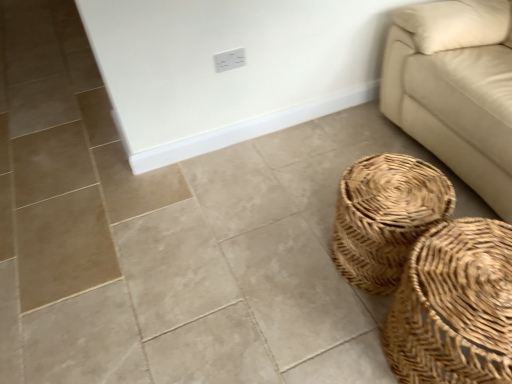
The height and width of the screenshot is (384, 512). Identify the location of vacant area on top of woven natural basket at lower right, which appears as the first basket when viewed from the back (from a real-world perspective). (391, 194).